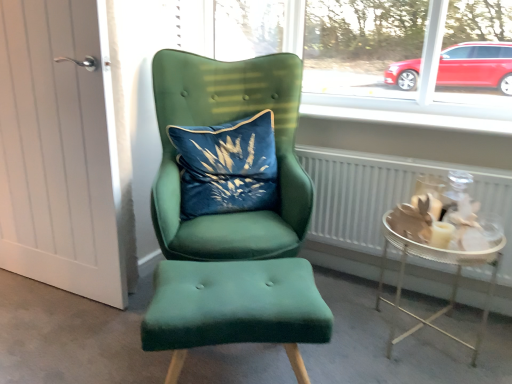
Identify the location of free space underneath metallic silver tray at lower right (from a real-world perspective). This screenshot has width=512, height=384. (424, 332).